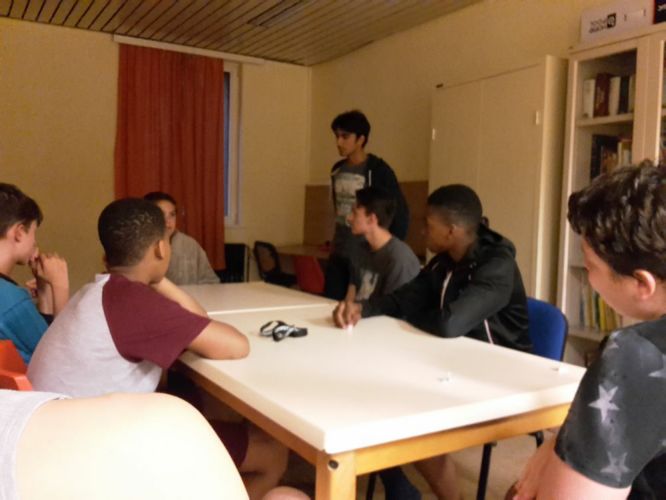
Where is `table`? table is located at coordinates (298, 396).